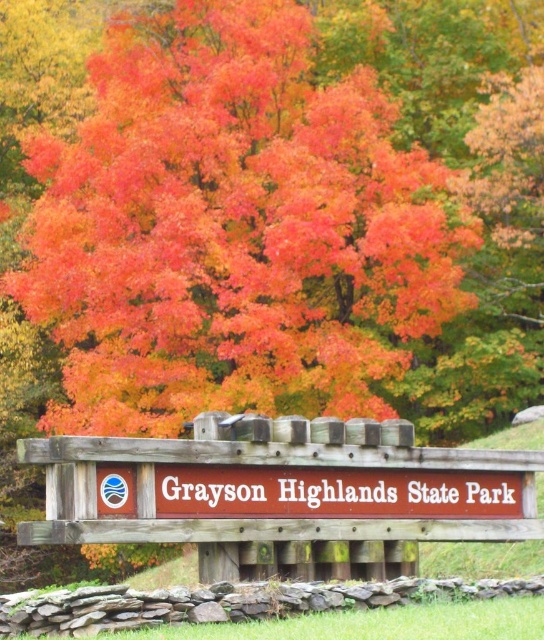
Consider the image. You are standing at the point marked by the coordinates point (232,228) in the image. What do you see around you?

At point (232,228), you are surrounded by vivid orange leaves at center.

You are a photographer standing at the base of the stone wall in front of the wooden sign. You want to take a photo that includes both the wooden sign and the large colorful tree in the background. Which of the two points, point 1 at coordinates (236, 180) or point 2 at (456, 467), is closer to your camera position?

Point 1 at coordinates (236, 180) is closer to your camera position because it is further to the camera than point 2 at (456, 467).